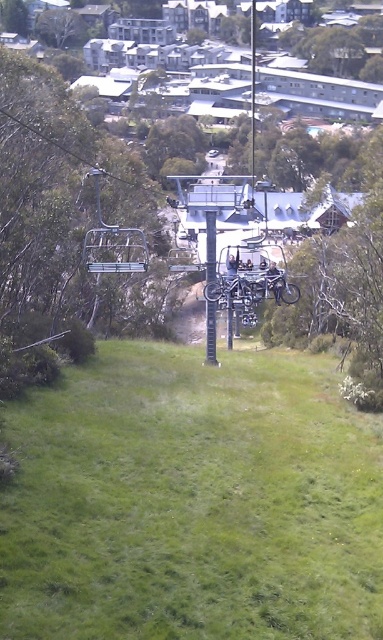
Question: Does green grassy at center lie in front of smooth bark tree at lower right?

Choices:
 (A) no
 (B) yes

Answer: (B)

Question: Estimate the real-world distances between objects in this image. Which object is closer to the green leafy tree at upper left?

Choices:
 (A) green grassy at center
 (B) metallic silver ski lift at center
 (C) green leafy tree at center

Answer: (C)

Question: Is smooth bark tree at lower right closer to the viewer compared to metallic silver bicycle at center?

Choices:
 (A) yes
 (B) no

Answer: (A)

Question: Which point appears farthest from the camera in this image?

Choices:
 (A) (309, 296)
 (B) (3, 189)
 (C) (22, 33)

Answer: (C)

Question: Does metallic pole at center come in front of metallic silver skis at center?

Choices:
 (A) no
 (B) yes

Answer: (A)

Question: Among these objects, which one is farthest from the camera?

Choices:
 (A) green leafy tree at center
 (B) green leafy tree at upper left
 (C) metallic silver bicycle at center
 (D) metallic silver ski lift at center

Answer: (B)